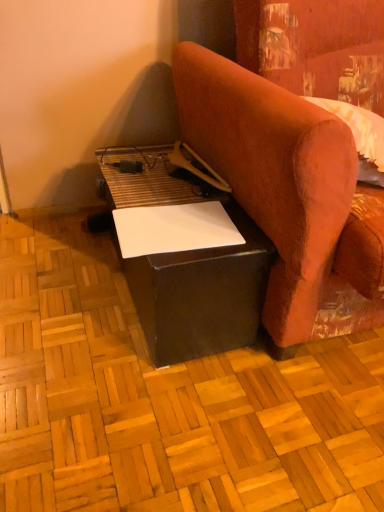
Question: Considering the relative positions of black matte table at lower center and matte black plywood at center in the image provided, is black matte table at lower center in front of matte black plywood at center?

Choices:
 (A) yes
 (B) no

Answer: (B)

Question: Is black matte table at lower center facing towards matte black plywood at center?

Choices:
 (A) no
 (B) yes

Answer: (A)

Question: Is black matte table at lower center thinner than matte black plywood at center?

Choices:
 (A) yes
 (B) no

Answer: (A)

Question: Is black matte table at lower center positioned behind matte black plywood at center?

Choices:
 (A) no
 (B) yes

Answer: (B)

Question: Can you confirm if black matte table at lower center is smaller than matte black plywood at center?

Choices:
 (A) no
 (B) yes

Answer: (A)

Question: In terms of width, does velvet-like orange armchair at right look wider or thinner when compared to black matte table at lower center?

Choices:
 (A) wide
 (B) thin

Answer: (A)

Question: Is velvet-like orange armchair at right bigger or smaller than black matte table at lower center?

Choices:
 (A) small
 (B) big

Answer: (B)

Question: Is velvet-like orange armchair at right spatially inside black matte table at lower center, or outside of it?

Choices:
 (A) outside
 (B) inside

Answer: (A)

Question: Relative to black matte table at lower center, is velvet-like orange armchair at right in front or behind?

Choices:
 (A) front
 (B) behind

Answer: (A)

Question: From the image's perspective, is white paper at lower center positioned above or below black matte table at lower center?

Choices:
 (A) below
 (B) above

Answer: (B)

Question: In the image, is white paper at lower center positioned in front of or behind black matte table at lower center?

Choices:
 (A) front
 (B) behind

Answer: (B)

Question: From a real-world perspective, is white paper at lower center above or below black matte table at lower center?

Choices:
 (A) below
 (B) above

Answer: (B)

Question: Looking at their shapes, would you say white paper at lower center is wider or thinner than black matte table at lower center?

Choices:
 (A) wide
 (B) thin

Answer: (B)

Question: From their relative heights in the image, would you say black matte table at lower center is taller or shorter than white paper at lower center?

Choices:
 (A) short
 (B) tall

Answer: (B)

Question: Visually, is black matte table at lower center positioned to the left or to the right of white paper at lower center?

Choices:
 (A) left
 (B) right

Answer: (A)